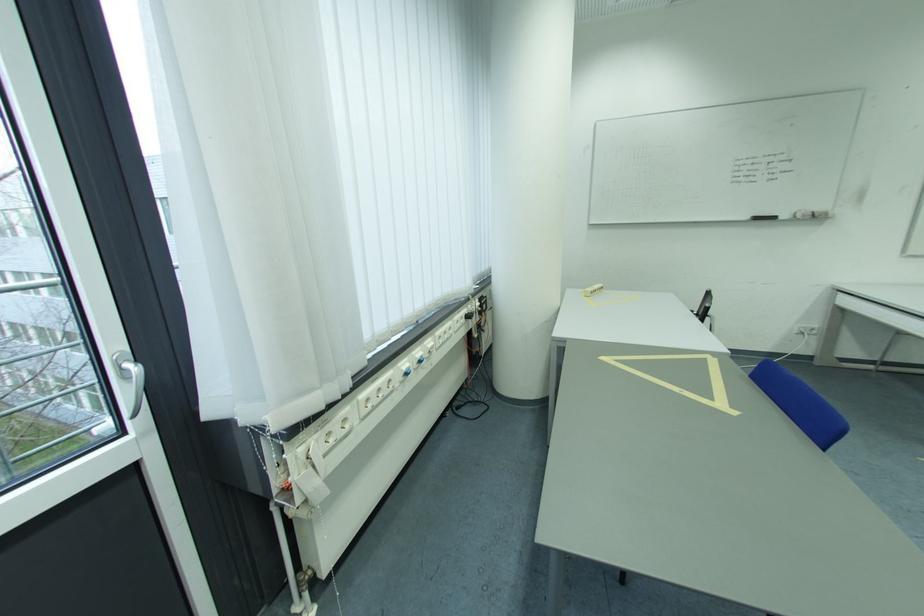
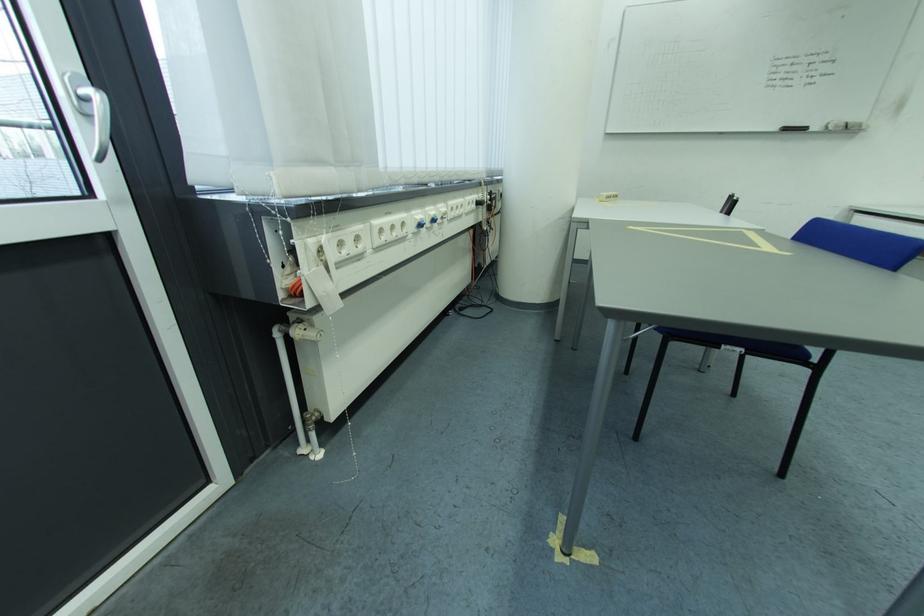
Locate, in the second image, the point that corresponds to [143,371] in the first image.

(106, 98)